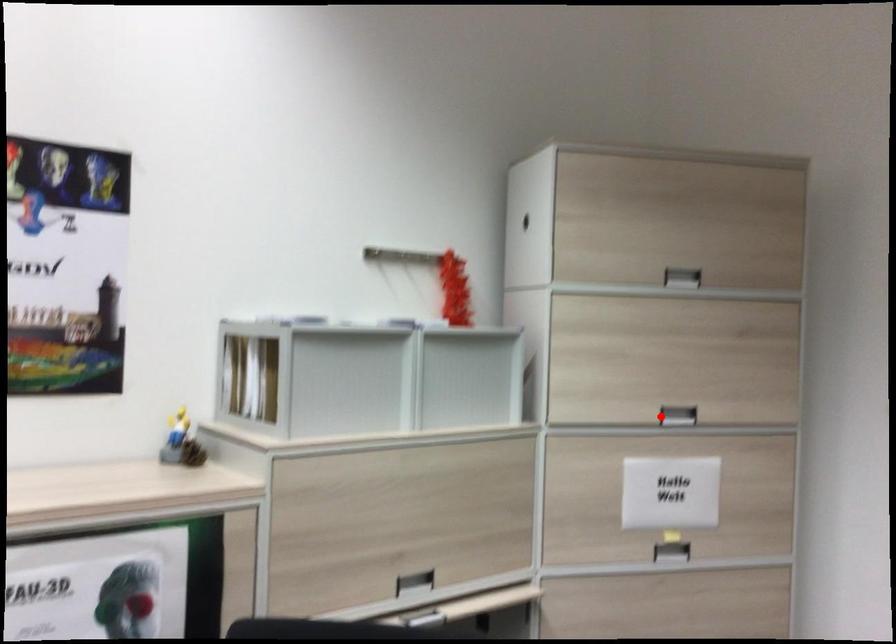
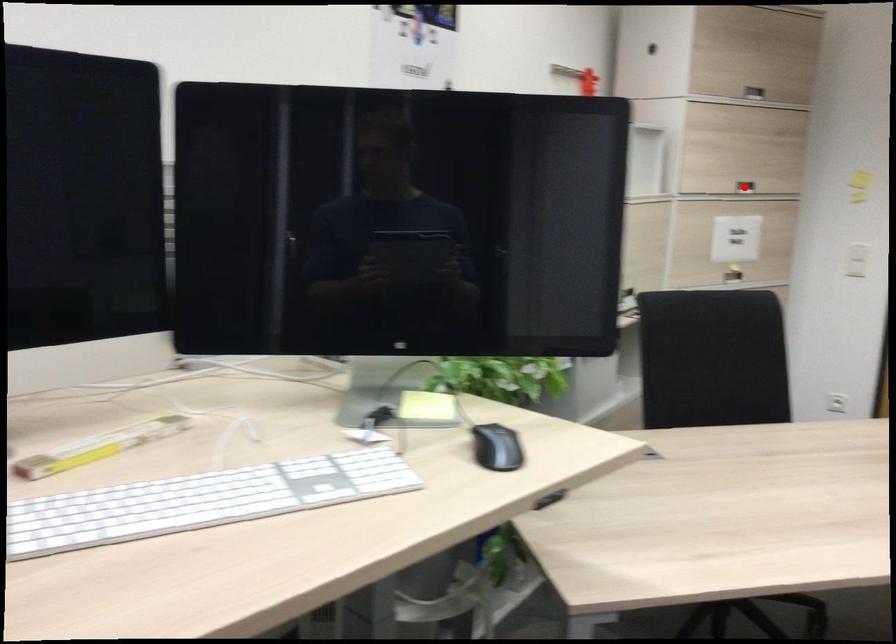
I am providing you with two images of the same scene from different viewpoints. A red point is marked on the first image and another point is marked on the second image. Does the point marked in image1 correspond to the same location as the one in image2?

Yes